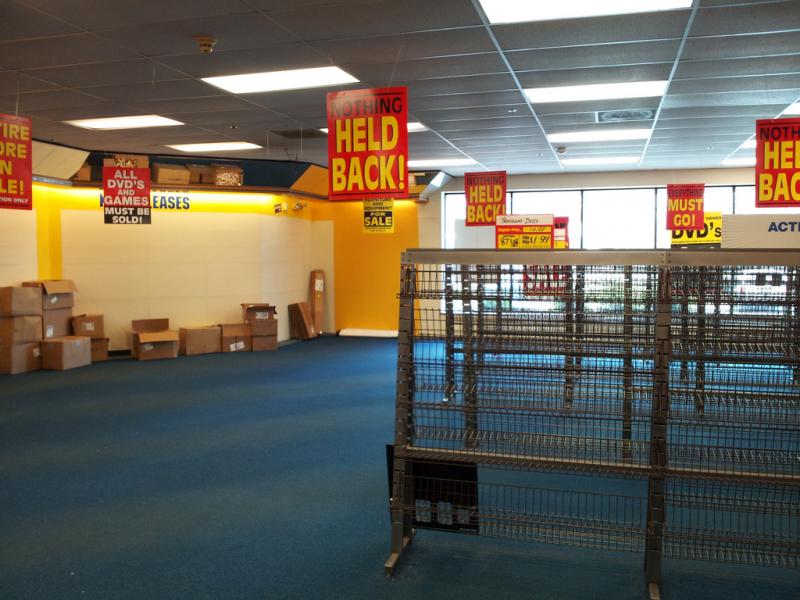
The height and width of the screenshot is (600, 800). What are the coordinates of `windows` in the screenshot? It's located at (581, 215), (522, 204), (661, 233).